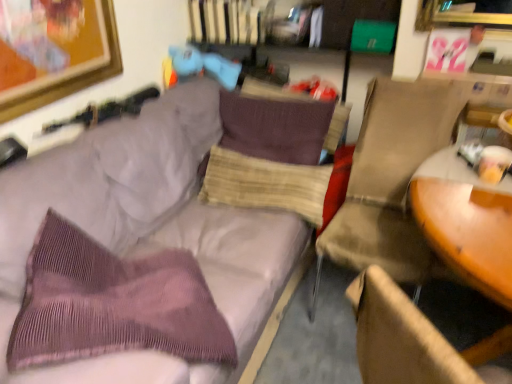
What do you see at coordinates (265, 184) in the screenshot? The height and width of the screenshot is (384, 512). I see `beige textured pillow at center, which is counted as the first pillow, starting from the bottom` at bounding box center [265, 184].

The width and height of the screenshot is (512, 384). Describe the element at coordinates (112, 304) in the screenshot. I see `purple corduroy throw pillow at left` at that location.

Identify the location of wooden round table at right. This screenshot has height=384, width=512. (466, 225).

Measure the distance between beige fabric chair at right and camera.

The depth of beige fabric chair at right is 1.51 meters.

Locate an element on the screen. Image resolution: width=512 pixels, height=384 pixels. purple corduroy pillow at center, marked as the 1th pillow in a top-to-bottom arrangement is located at coordinates (275, 127).

Is beige textured pillow at center, the 2th pillow when ordered from top to bottom, inside beige fabric chair at right?

No, beige textured pillow at center, the 2th pillow when ordered from top to bottom, is not a part of beige fabric chair at right.

How far apart are beige fabric chair at right and beige textured pillow at center, the 2th pillow when ordered from top to bottom?

They are 15.06 inches apart.

Considering their positions, is beige fabric chair at right located in front of or behind beige textured pillow at center, which is counted as the first pillow, starting from the bottom?

In the image, beige fabric chair at right appears in front of beige textured pillow at center, which is counted as the first pillow, starting from the bottom.

Considering the relative sizes of beige fabric chair at right and beige textured pillow at center, which is counted as the first pillow, starting from the bottom, in the image provided, is beige fabric chair at right wider than beige textured pillow at center, which is counted as the first pillow, starting from the bottom,?

Correct, the width of beige fabric chair at right exceeds that of beige textured pillow at center, which is counted as the first pillow, starting from the bottom.

Locate an element on the screen. The height and width of the screenshot is (384, 512). toy that is above the purple corduroy pillow at center, the second pillow from the bottom (from a real-world perspective) is located at coordinates (204, 65).

Which object is more forward, matte blue plush at upper center or purple corduroy pillow at center, the second pillow from the bottom?

purple corduroy pillow at center, the second pillow from the bottom, is more forward.

Based on their positions, is matte blue plush at upper center located to the left or right of purple corduroy pillow at center, marked as the 1th pillow in a top-to-bottom arrangement?

In the image, matte blue plush at upper center appears on the left side of purple corduroy pillow at center, marked as the 1th pillow in a top-to-bottom arrangement.

From the picture: Is matte blue plush at upper center looking in the opposite direction of purple corduroy pillow at center, the second pillow from the bottom?

No, purple corduroy pillow at center, the second pillow from the bottom, is not at the back of matte blue plush at upper center.

From the picture: Which of these two, beige fabric chair at right or wooden round table at right, is smaller?

wooden round table at right.

Between beige fabric chair at right and wooden round table at right, which one is positioned behind?

Positioned behind is beige fabric chair at right.

Which of these two, beige fabric chair at right or wooden round table at right, stands shorter?

With less height is beige fabric chair at right.

From a real-world perspective, between beige fabric chair at right and wooden round table at right, who is vertically higher?

From a 3D spatial view, beige fabric chair at right is above.

Is point (426, 130) positioned after point (302, 103)?

No, it is not.

Who is smaller, beige fabric chair at right or purple corduroy pillow at center, marked as the 1th pillow in a top-to-bottom arrangement?

Smaller between the two is purple corduroy pillow at center, marked as the 1th pillow in a top-to-bottom arrangement.

From a real-world perspective, which is physically above, beige fabric chair at right or purple corduroy pillow at center, marked as the 1th pillow in a top-to-bottom arrangement?

purple corduroy pillow at center, marked as the 1th pillow in a top-to-bottom arrangement, is physically above.

In the image, is beige fabric chair at right positioned in front of or behind purple corduroy pillow at center, the second pillow from the bottom?

Clearly, beige fabric chair at right is in front of purple corduroy pillow at center, the second pillow from the bottom.

In the scene shown: Looking at their sizes, would you say purple corduroy pillow at center, marked as the 1th pillow in a top-to-bottom arrangement, is wider or thinner than wooden round table at right?

Clearly, purple corduroy pillow at center, marked as the 1th pillow in a top-to-bottom arrangement, has less width compared to wooden round table at right.

Does purple corduroy pillow at center, marked as the 1th pillow in a top-to-bottom arrangement, have a larger size compared to wooden round table at right?

Actually, purple corduroy pillow at center, marked as the 1th pillow in a top-to-bottom arrangement, might be smaller than wooden round table at right.

Which is in front, point (328, 119) or point (497, 211)?

The point (497, 211) is more forward.

Between purple corduroy pillow at center, the second pillow from the bottom, and wooden round table at right, which one has more height?

wooden round table at right is taller.

Between beige fabric chair at right and matte blue plush at upper center, which one has smaller size?

Smaller between the two is matte blue plush at upper center.

From the image's perspective, which is below, beige fabric chair at right or matte blue plush at upper center?

beige fabric chair at right, from the image's perspective.

From a real-world perspective, is beige fabric chair at right on matte blue plush at upper center?

Incorrect, from a real-world perspective, beige fabric chair at right is lower than matte blue plush at upper center.

Is beige textured pillow at center, the 2th pillow when ordered from top to bottom, facing away from wooden round table at right?

No.

How far apart are beige textured pillow at center, which is counted as the first pillow, starting from the bottom, and wooden round table at right?

beige textured pillow at center, which is counted as the first pillow, starting from the bottom, and wooden round table at right are 29.52 inches apart.

From a real-world perspective, is beige textured pillow at center, the 2th pillow when ordered from top to bottom, over wooden round table at right?

No, from a real-world perspective, beige textured pillow at center, the 2th pillow when ordered from top to bottom, is not over wooden round table at right

Would you say beige textured pillow at center, the 2th pillow when ordered from top to bottom, is outside wooden round table at right?

beige textured pillow at center, the 2th pillow when ordered from top to bottom, lies outside wooden round table at right's area.

The width and height of the screenshot is (512, 384). Identify the location of chair that appears above the beige textured pillow at center, the 2th pillow when ordered from top to bottom (from a real-world perspective). (390, 178).

At what (x,y) coordinates should I click in order to perform the action: click on toy behind the purple corduroy pillow at center, the second pillow from the bottom. Please return your answer as a coordinate pair (x, y). This screenshot has height=384, width=512. Looking at the image, I should click on (x=204, y=65).

From the picture: Considering their positions, is wooden round table at right positioned further to purple corduroy couch at upper left than purple corduroy pillow at center, marked as the 1th pillow in a top-to-bottom arrangement?

Based on the image, wooden round table at right appears to be further to purple corduroy couch at upper left.

Looking at the image, which one is located closer to wooden round table at right, purple corduroy couch at upper left or purple corduroy throw pillow at left?

Among the two, purple corduroy couch at upper left is located nearer to wooden round table at right.

Estimate the real-world distances between objects in this image. Which object is further from purple corduroy couch at upper left, purple corduroy pillow at center, marked as the 1th pillow in a top-to-bottom arrangement, or wooden round table at right?

Based on the image, wooden round table at right appears to be further to purple corduroy couch at upper left.

Based on their spatial positions, is beige fabric chair at right or matte blue plush at upper center closer to purple corduroy couch at upper left?

beige fabric chair at right is positioned closer to the anchor purple corduroy couch at upper left.

Estimate the real-world distances between objects in this image. Which object is further from purple corduroy couch at upper left, purple corduroy throw pillow at left or beige fabric chair at right?

beige fabric chair at right is further to purple corduroy couch at upper left.

From the picture: Which object lies nearer to the anchor point beige textured pillow at center, the 2th pillow when ordered from top to bottom, matte blue plush at upper center or purple corduroy couch at upper left?

purple corduroy couch at upper left.

Based on their spatial positions, is beige textured pillow at center, which is counted as the first pillow, starting from the bottom, or beige fabric chair at right closer to matte blue plush at upper center?

beige textured pillow at center, which is counted as the first pillow, starting from the bottom.

Looking at this image, which object lies further to the anchor point purple corduroy pillow at center, marked as the 1th pillow in a top-to-bottom arrangement, purple corduroy couch at upper left or beige textured pillow at center, the 2th pillow when ordered from top to bottom?

purple corduroy couch at upper left.

Locate an element on the screen. The height and width of the screenshot is (384, 512). studio couch situated between purple corduroy throw pillow at left and beige fabric chair at right from left to right is located at coordinates (148, 228).

Identify the location of chair between purple corduroy throw pillow at left and wooden round table at right. [x=390, y=178].

Where is `pillow between wooden round table at right and purple corduroy pillow at center, the second pillow from the bottom, along the z-axis`? pillow between wooden round table at right and purple corduroy pillow at center, the second pillow from the bottom, along the z-axis is located at coordinates (265, 184).

Where is `studio couch positioned between wooden round table at right and purple corduroy pillow at center, the second pillow from the bottom, from near to far`? The image size is (512, 384). studio couch positioned between wooden round table at right and purple corduroy pillow at center, the second pillow from the bottom, from near to far is located at coordinates (148, 228).